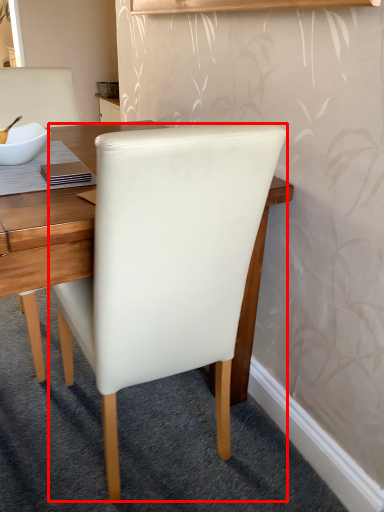
Question: From the image's perspective, what is the correct spatial relationship of chair (annotated by the red box) in relation to bowl?

Choices:
 (A) above
 (B) below

Answer: (B)